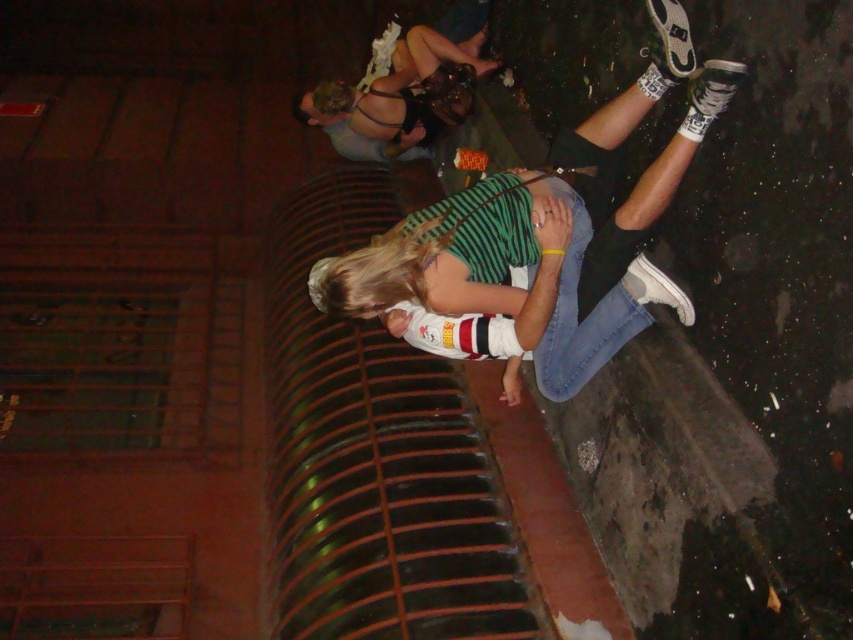
You are a fashion designer observing the nighttime scene. You notice the white matte sneakers at center and the black leather dress at upper center. Which of these two items has a greater height?

The white matte sneakers at center has a greater height compared to the black leather dress at upper center.

You are a photographer trying to capture the scene. You need to focus on the black leather dress at upper center and the white matte sneakers at center. Which object should you adjust your camera to the right to capture?

The white matte sneakers at center are to the right of the black leather dress at upper center, so to capture the white matte sneakers at center, you should adjust your camera to the right from the black leather dress at upper center.

You are a delivery robot in the scene. You need to deliver a package to the person wearing the white matte sneakers at center. The coordinates of your current position are at point 0.5, 0.5. Can you reach them directly without moving past the metallic structure?

The white matte sneakers at center are located at point (543, 218). Since your current position is at (426, 320), you can move directly towards them without needing to go around the metallic structure.